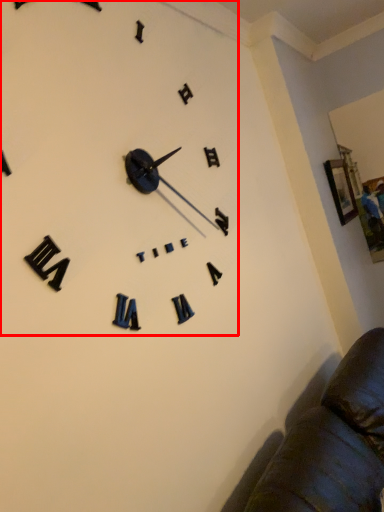
Question: Where is clock (annotated by the red box) located in relation to picture frame in the image?

Choices:
 (A) right
 (B) left

Answer: (B)